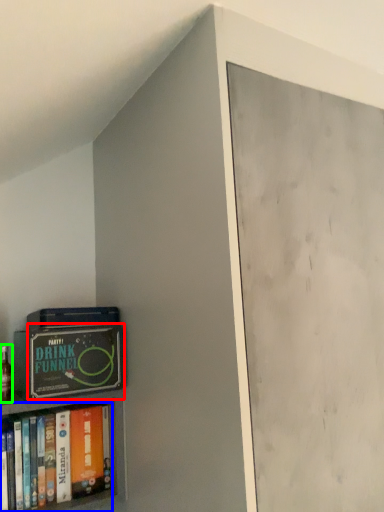
Question: Considering the real-world distances, which object is farthest from paperback book (highlighted by a red box)? book (highlighted by a blue box) or alcohol (highlighted by a green box)?

Choices:
 (A) book
 (B) alcohol

Answer: (B)